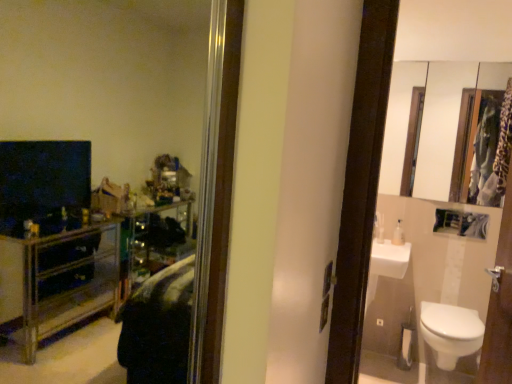
Question: Does white glossy mirror at upper right appear on the right side of white glossy toilet at lower right?

Choices:
 (A) yes
 (B) no

Answer: (B)

Question: Does white glossy mirror at upper right lie behind white glossy toilet at lower right?

Choices:
 (A) yes
 (B) no

Answer: (A)

Question: Is white glossy mirror at upper right aimed at white glossy toilet at lower right?

Choices:
 (A) yes
 (B) no

Answer: (B)

Question: Is white glossy mirror at upper right shorter than white glossy toilet at lower right?

Choices:
 (A) yes
 (B) no

Answer: (B)

Question: Does white glossy mirror at upper right have a greater height compared to white glossy toilet at lower right?

Choices:
 (A) no
 (B) yes

Answer: (B)

Question: Considering the relative sizes of white glossy mirror at upper right and white glossy toilet at lower right in the image provided, is white glossy mirror at upper right wider than white glossy toilet at lower right?

Choices:
 (A) yes
 (B) no

Answer: (B)

Question: Is white glossy toilet at lower right turned away from clear plastic bottle at right?

Choices:
 (A) yes
 (B) no

Answer: (B)

Question: From the image's perspective, does white glossy toilet at lower right appear lower than clear plastic bottle at right?

Choices:
 (A) no
 (B) yes

Answer: (B)

Question: Considering the relative sizes of white glossy toilet at lower right and clear plastic bottle at right in the image provided, is white glossy toilet at lower right wider than clear plastic bottle at right?

Choices:
 (A) no
 (B) yes

Answer: (B)

Question: Is clear plastic bottle at right a part of white glossy toilet at lower right?

Choices:
 (A) no
 (B) yes

Answer: (A)

Question: Does white glossy toilet at lower right have a lesser height compared to clear plastic bottle at right?

Choices:
 (A) yes
 (B) no

Answer: (B)

Question: From a real-world perspective, is white glossy toilet at lower right under clear plastic bottle at right?

Choices:
 (A) yes
 (B) no

Answer: (A)

Question: From a real-world perspective, is clear plastic bottle at right beneath white glossy toilet at lower right?

Choices:
 (A) no
 (B) yes

Answer: (A)